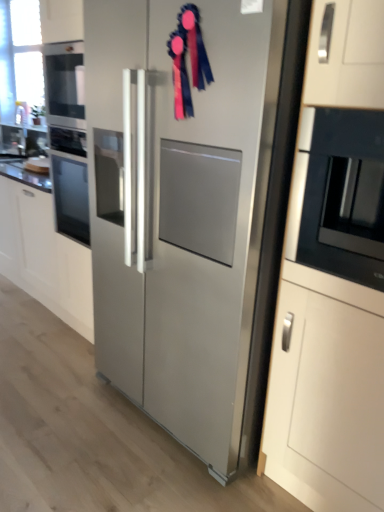
Question: In the image, is stainless steel refrigerator at center on the left side or the right side of blue satin ribbon at upper center?

Choices:
 (A) right
 (B) left

Answer: (A)

Question: Looking at their shapes, would you say stainless steel refrigerator at center is wider or thinner than blue satin ribbon at upper center?

Choices:
 (A) wide
 (B) thin

Answer: (A)

Question: Which object is positioned farthest from the satin white cabinet at center?

Choices:
 (A) black glossy microwave at right
 (B) brushed metal sink at left
 (C) stainless steel refrigerator at center
 (D) blue satin ribbon at upper center
 (E) white glossy countertop at left

Answer: (A)

Question: Based on their relative distances, which object is farther from the black glossy microwave at right?

Choices:
 (A) stainless steel refrigerator at center
 (B) blue satin ribbon at upper center
 (C) white glossy countertop at left
 (D) satin white cabinet at center
 (E) brushed metal sink at left

Answer: (E)